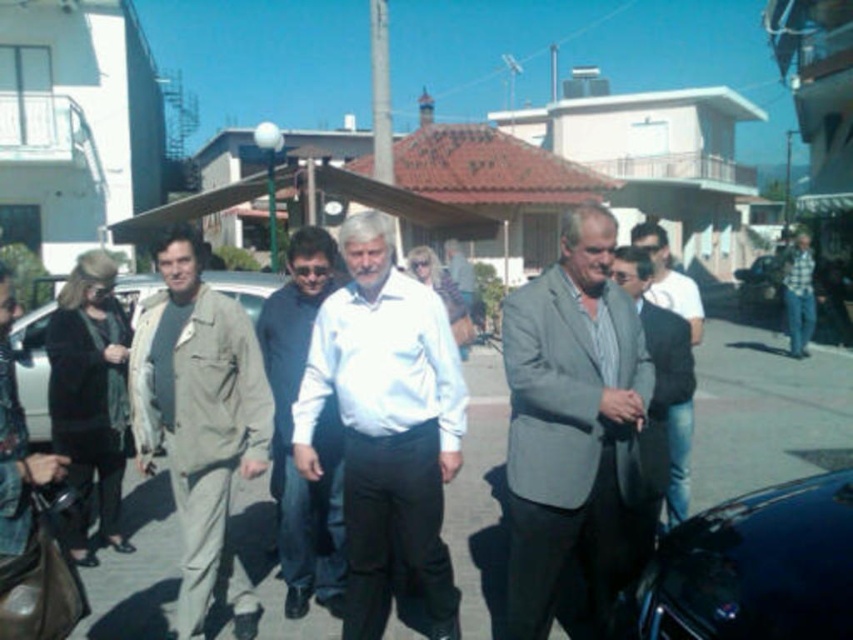
You are a delivery person who needs to park your 2.5 meter long delivery van on the dark gray asphalt at center. The asphalt is at point 0.647, 0.898. Can you park your van there?

The dark gray asphalt at center is at point (764, 413), but the description does not provide information about the asphalt area size or space available. Therefore, it is uncertain if the van can be parked there.

You are a photographer trying to capture a photo of both the white smooth shirt at center and the shiny black car at lower right. However, the car is partially blocked by the shirt. Based on their sizes in the image, which object should you adjust your camera angle to focus on first to ensure both are visible?

The white smooth shirt at center is larger in size than the shiny black car at lower right, so you should adjust your camera angle to focus on the white smooth shirt at center first to ensure it doesn not block the smaller shiny black car at lower right.

From the picture: You are standing in the residential area depicted in the image and want to walk from point A to point B. The coordinates for point A are point A at (456, 547) and point B are point B at (669, 292). Since you can only move forward, which point should you aim for first if you want to reach point B without backtracking?

You should aim for point B at (669, 292) first because point A at (456, 547) is further to the viewer, meaning point B is located behind point A in the scene. By moving forward towards point B, you can reach it without needing to backtrack.